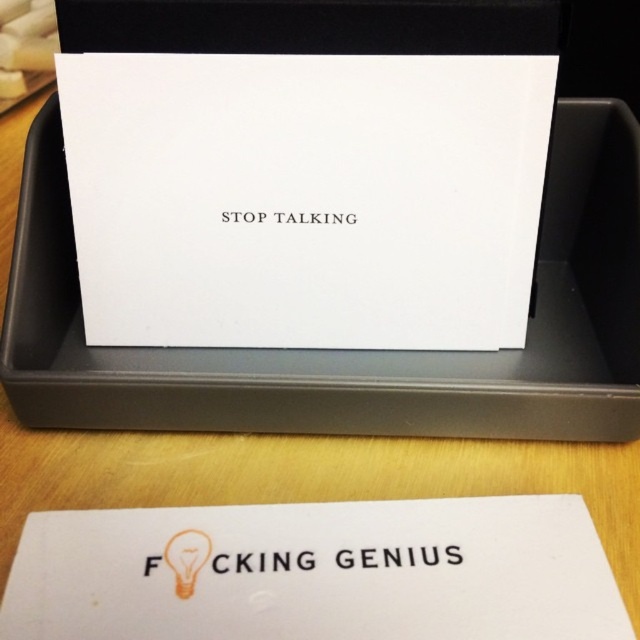
Question: Does white paper at center appear on the right side of white matte card at center?

Choices:
 (A) yes
 (B) no

Answer: (A)

Question: Which object appears closest to the camera in this image?

Choices:
 (A) white paper at center
 (B) white matte card at center

Answer: (B)

Question: From the image, what is the correct spatial relationship of white paper at center in relation to white matte card at center?

Choices:
 (A) above
 (B) below

Answer: (A)

Question: Is white paper at center positioned behind white matte card at center?

Choices:
 (A) yes
 (B) no

Answer: (A)

Question: Which point is farther to the camera?

Choices:
 (A) white paper at center
 (B) white matte card at center

Answer: (A)